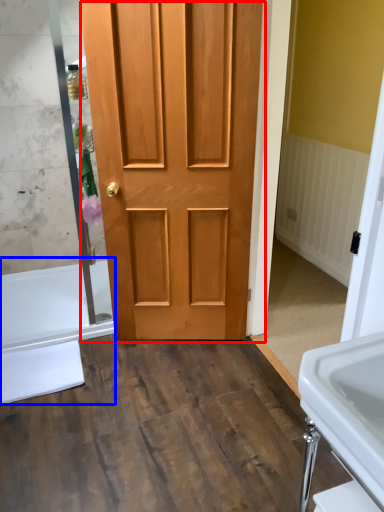
Question: Which point is further to the camera, door (highlighted by a red box) or bath (highlighted by a blue box)?

Choices:
 (A) door
 (B) bath

Answer: (B)